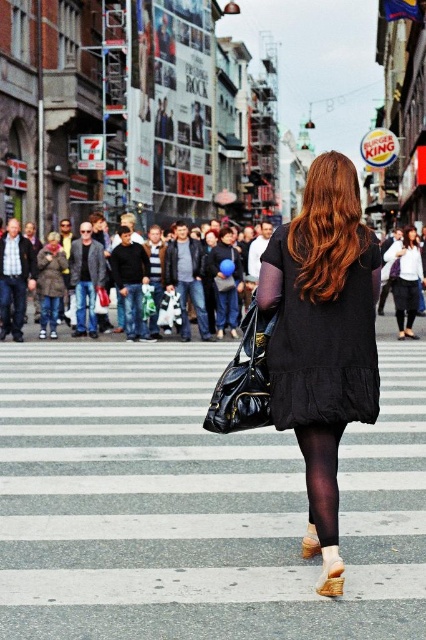
Who is positioned more to the left, leather beige boot at lower center or brown suede boot at lower center?

From the viewer's perspective, brown suede boot at lower center appears more on the left side.

I want to click on leather beige boot at lower center, so click(x=331, y=577).

You are a GUI agent. You are given a task and a screenshot of the screen. Output one action in this format:
    pyautogui.click(x=<x>, y=<y>)
    Task: Click on the leather beige boot at lower center
    
    Given the screenshot: What is the action you would take?
    pyautogui.click(x=331, y=577)

Is the position of black cotton dress at center less distant than that of black sheer tights at lower center?

That is False.

Image resolution: width=426 pixels, height=640 pixels. What are the coordinates of `black cotton dress at center` in the screenshot? It's located at pos(322,342).

Which is below, shiny auburn hair at center or brown suede boot at lower center?

brown suede boot at lower center is below.

Based on the photo, can you confirm if shiny auburn hair at center is taller than brown suede boot at lower center?

Yes, shiny auburn hair at center is taller than brown suede boot at lower center.

The image size is (426, 640). What do you see at coordinates (328, 228) in the screenshot?
I see `shiny auburn hair at center` at bounding box center [328, 228].

The image size is (426, 640). I want to click on shiny auburn hair at center, so click(328, 228).